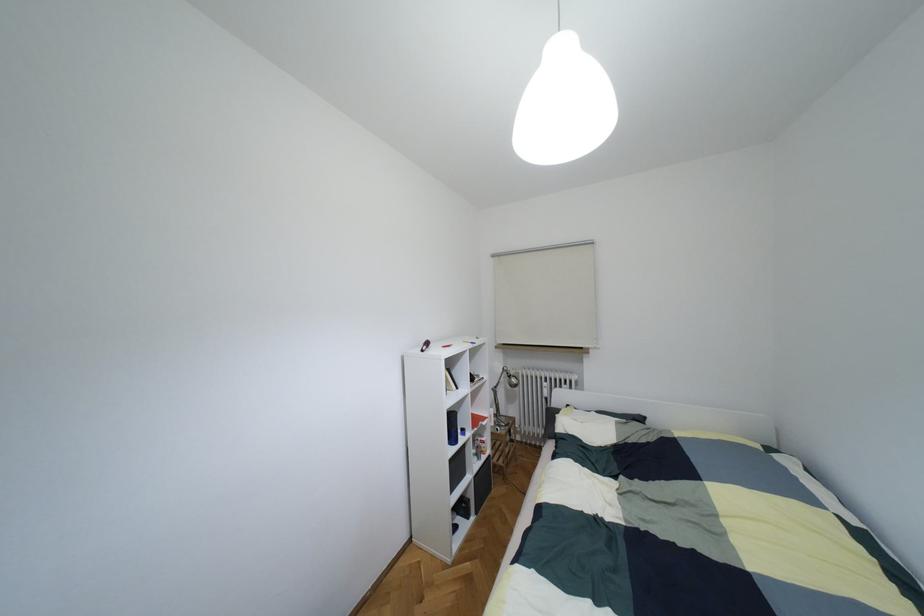
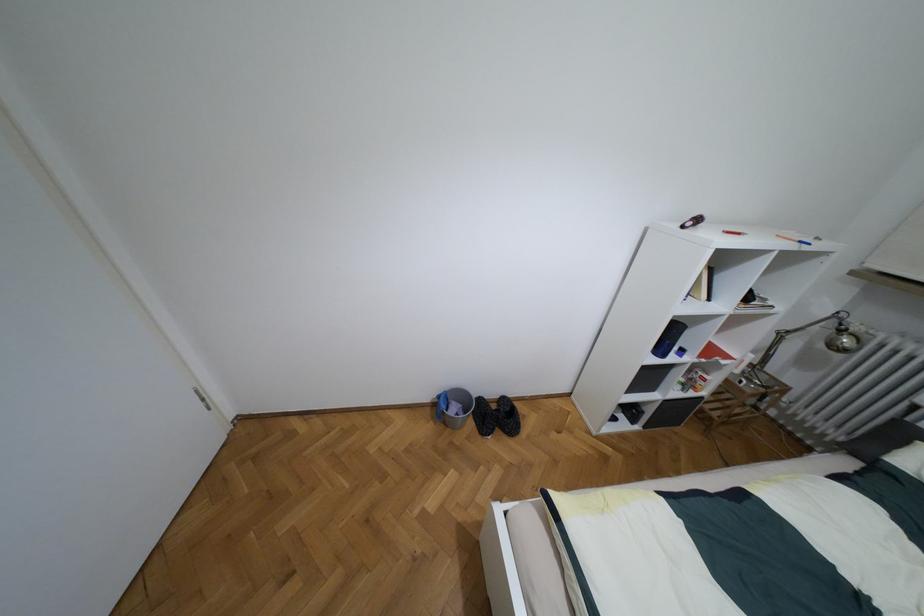
The point at (x=451, y=416) is marked in the first image. Where is the corresponding point in the second image?

(675, 326)